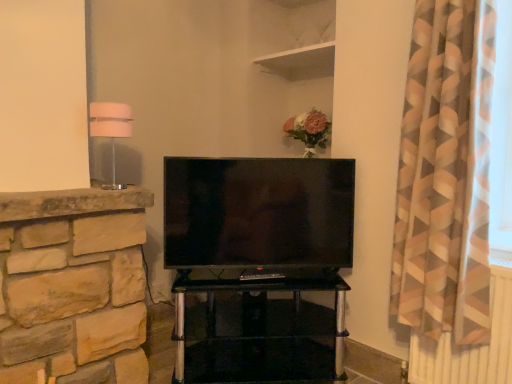
Question: Is matte black tv at center wider or thinner than geometric-patterned fabric curtain at right?

Choices:
 (A) wide
 (B) thin

Answer: (B)

Question: Would you say matte black tv at center is inside or outside geometric-patterned fabric curtain at right?

Choices:
 (A) inside
 (B) outside

Answer: (B)

Question: Considering the real-world distances, which object is closest to the white fabric lampshade at left?

Choices:
 (A) white matte shelf at upper center, the first shelf positioned from the top
 (B) white matte shelf at upper center, which ranks as the first shelf in bottom-to-top order
 (C) transparent glass tv stand at center
 (D) matte black tv at center
 (E) geometric-patterned fabric curtain at right

Answer: (D)

Question: Estimate the real-world distances between objects in this image. Which object is closer to the white matte shelf at upper center, which ranks as the first shelf in bottom-to-top order?

Choices:
 (A) transparent glass tv stand at center
 (B) geometric-patterned fabric curtain at right
 (C) white matte shelf at upper center, the first shelf positioned from the top
 (D) white fabric lampshade at left
 (E) matte black tv at center

Answer: (C)